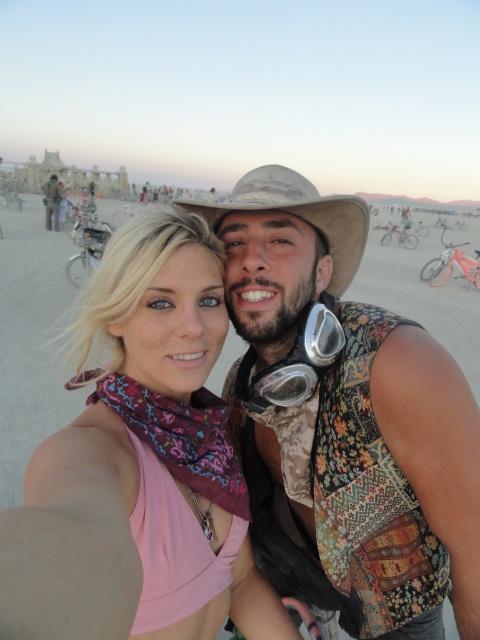
You are at the desert festival and want to know if you can place the silver metallic goggles at center into a narrow pouch that fits items thinner than the matte black jacket at upper left. Can you do that?

The silver metallic goggles at center is thinner than the matte black jacket at upper left, so yes, it can fit into the narrow pouch designed for items thinner than the matte black jacket at upper left.

You are at a desert festival and need to hand a map to someone holding the pink fabric scarf at center from where you are standing near the matte black jacket at upper left. Can you directly hand it to them without walking towards them?

The pink fabric scarf at center and matte black jacket at upper left are 270.58 feet apart, so you would need to walk towards them to hand the map directly since the distance is too far to reach without moving.